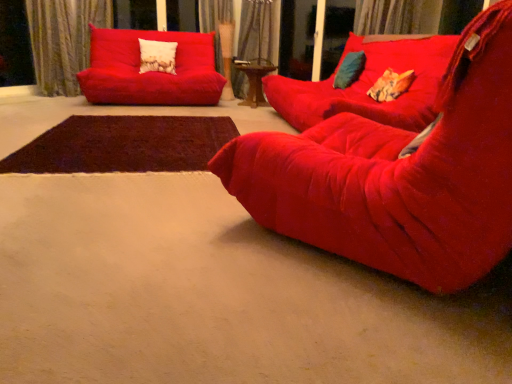
Question: Can you confirm if orange fabric pillow at center, which is the 1th pillow from bottom to top, is bigger than velvet textured pillow at upper center, which is the first pillow in left-to-right order?

Choices:
 (A) no
 (B) yes

Answer: (A)

Question: Can you confirm if orange fabric pillow at center, which is the 1th pillow from bottom to top, is shorter than velvet textured pillow at upper center, which appears as the 3th pillow when viewed from the front?

Choices:
 (A) no
 (B) yes

Answer: (B)

Question: Is orange fabric pillow at center, which is the 1th pillow in right-to-left order, turned away from velvet textured pillow at upper center, the third pillow when ordered from bottom to top?

Choices:
 (A) no
 (B) yes

Answer: (A)

Question: Considering the relative positions of orange fabric pillow at center, the 1th pillow viewed from the front, and velvet textured pillow at upper center, acting as the first pillow starting from the back, in the image provided, is orange fabric pillow at center, the 1th pillow viewed from the front, to the right of velvet textured pillow at upper center, acting as the first pillow starting from the back, from the viewer's perspective?

Choices:
 (A) yes
 (B) no

Answer: (A)

Question: From a real-world perspective, is orange fabric pillow at center, which is the 3th pillow from left to right, physically above velvet textured pillow at upper center, acting as the first pillow starting from the back?

Choices:
 (A) no
 (B) yes

Answer: (A)

Question: In terms of height, does velvet curtain at upper left, which appears as the third curtain when viewed from the right, look taller or shorter compared to velvet red studio couch at center, which ranks as the 2th studio couch in front-to-back order?

Choices:
 (A) short
 (B) tall

Answer: (B)

Question: Visually, is velvet curtain at upper left, which appears as the third curtain when viewed from the right, positioned to the left or to the right of velvet red studio couch at center, placed as the 2th studio couch when sorted from back to front?

Choices:
 (A) left
 (B) right

Answer: (A)

Question: In the image, is velvet curtain at upper left, which appears as the third curtain when viewed from the right, positioned in front of or behind velvet red studio couch at center, which ranks as the 2th studio couch in front-to-back order?

Choices:
 (A) behind
 (B) front

Answer: (A)

Question: In terms of width, does velvet curtain at upper left, which appears as the third curtain when viewed from the right, look wider or thinner when compared to velvet red studio couch at center, placed as the 2th studio couch when sorted from back to front?

Choices:
 (A) thin
 (B) wide

Answer: (A)

Question: Is velvet red studio couch at center, placed as the 2th studio couch when sorted from back to front, situated inside velvet textured pillow at upper center, the third pillow when ordered from bottom to top, or outside?

Choices:
 (A) outside
 (B) inside

Answer: (A)

Question: In terms of width, does velvet red studio couch at center, which ranks as the 2th studio couch in front-to-back order, look wider or thinner when compared to velvet textured pillow at upper center, which appears as the 3th pillow when viewed from the front?

Choices:
 (A) thin
 (B) wide

Answer: (B)

Question: Considering their positions, is velvet red studio couch at center, placed as the 2th studio couch when sorted from back to front, located in front of or behind velvet textured pillow at upper center, the third pillow when ordered from bottom to top?

Choices:
 (A) front
 (B) behind

Answer: (A)

Question: Considering the positions of point (377, 112) and point (165, 67), is point (377, 112) closer or farther from the camera than point (165, 67)?

Choices:
 (A) closer
 (B) farther

Answer: (A)

Question: Considering the positions of velvet curtain at upper center, the 3th curtain positioned from the left, and orange fabric pillow at center, positioned as the third pillow in back-to-front order, in the image, is velvet curtain at upper center, the 3th curtain positioned from the left, taller or shorter than orange fabric pillow at center, positioned as the third pillow in back-to-front order,?

Choices:
 (A) short
 (B) tall

Answer: (B)

Question: Based on their sizes in the image, would you say velvet curtain at upper center, placed as the 1th curtain when sorted from right to left, is bigger or smaller than orange fabric pillow at center, which is the 1th pillow from bottom to top?

Choices:
 (A) big
 (B) small

Answer: (A)